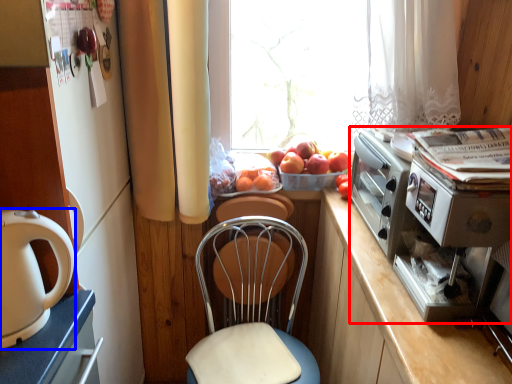
Question: Which of the following is the closest to the observer, appliance (highlighted by a red box) or home appliance (highlighted by a blue box)?

Choices:
 (A) appliance
 (B) home appliance

Answer: (B)